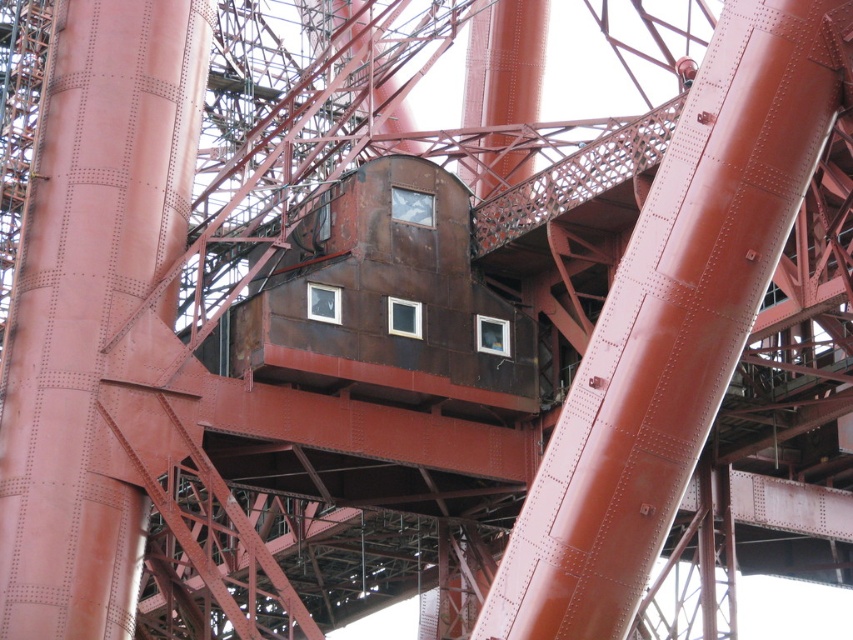
You are a construction worker standing at the base of the rusty metal tower at center. You need to move to the rusty metal pole at center, which is 2 meters away from your current position. Is the distance between them sufficient for you to walk directly to the pole without needing any equipment?

The distance between the rusty metal pole at center and the rusty metal tower at center is 24.43 meters. Since you are only 2 meters away from the tower, the remaining distance to the pole is 22.43 meters, which is quite far. You would need to use equipment or a path to reach it.

From the picture: You are standing at the bottom of the industrial structure depicted in the image. You notice a point marked at coordinates (x=669, y=326). What object does this point correspond to?

The point at coordinates (x=669, y=326) corresponds to the rusty metal pole at center.

You are an engineer inspecting the structure. You need to locate the rusty metal pole at center. According to the coordinates provided, where would you find it in the image?

The rusty metal pole at center is located at point (669, 326) in the image.